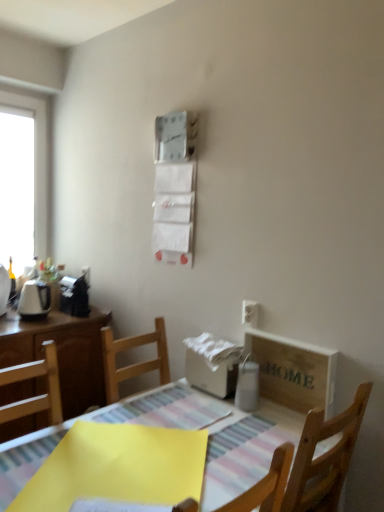
This screenshot has width=384, height=512. In order to click on free point below wooden crate at lower right (from a real-world perspective) in this screenshot , I will do `click(283, 407)`.